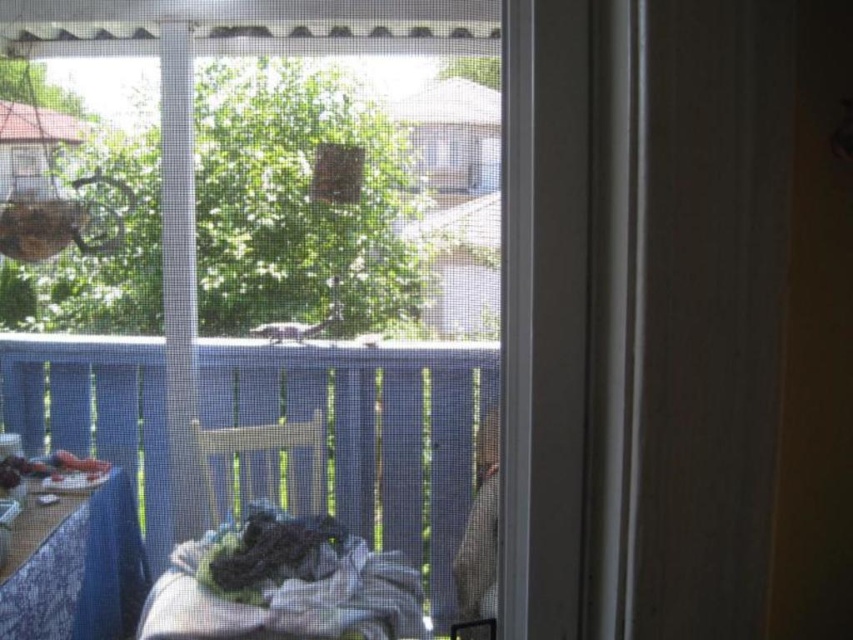
Question: Can you confirm if transparent plastic window at center is positioned below wooden table at lower left?

Choices:
 (A) yes
 (B) no

Answer: (B)

Question: Is transparent plastic window at center positioned before wooden table at lower left?

Choices:
 (A) yes
 (B) no

Answer: (A)

Question: Among these objects, which one is farthest from the camera?

Choices:
 (A) wooden table at lower left
 (B) transparent plastic window at center

Answer: (A)

Question: Can you confirm if transparent plastic window at center is positioned to the right of wooden table at lower left?

Choices:
 (A) no
 (B) yes

Answer: (B)